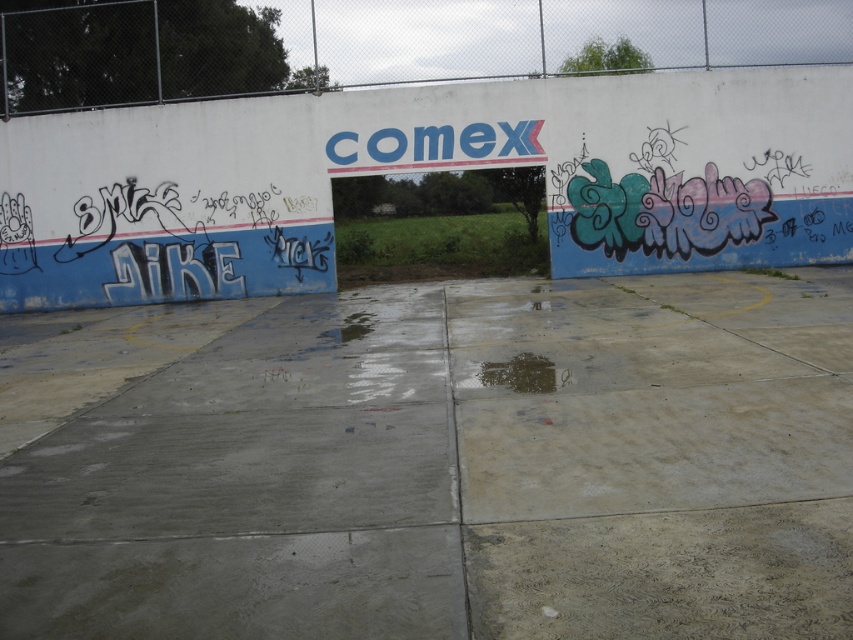
Can you confirm if gray concrete at center is positioned below white chain-link fence at upper center?

Yes, gray concrete at center is below white chain-link fence at upper center.

Is gray concrete at center above white chain-link fence at upper center?

Incorrect, gray concrete at center is not positioned above white chain-link fence at upper center.

Between point (567, 394) and point (607, 1), which one is positioned in front?

Point (567, 394) is more forward.

The image size is (853, 640). I want to click on gray concrete at center, so click(434, 461).

In the scene shown: Is gray concrete at center to the left of dark wet concrete puddle at center from the viewer's perspective?

Incorrect, gray concrete at center is not on the left side of dark wet concrete puddle at center.

Does gray concrete at center appear under dark wet concrete puddle at center?

Actually, gray concrete at center is above dark wet concrete puddle at center.

The width and height of the screenshot is (853, 640). I want to click on gray concrete at center, so click(x=434, y=461).

Between point (773, 29) and point (531, 392), which one is positioned behind?

Positioned behind is point (773, 29).

Between white chain-link fence at upper center and dark wet concrete puddle at center, which one has more height?

With more height is white chain-link fence at upper center.

Identify the location of white chain-link fence at upper center. The image size is (853, 640). (381, 42).